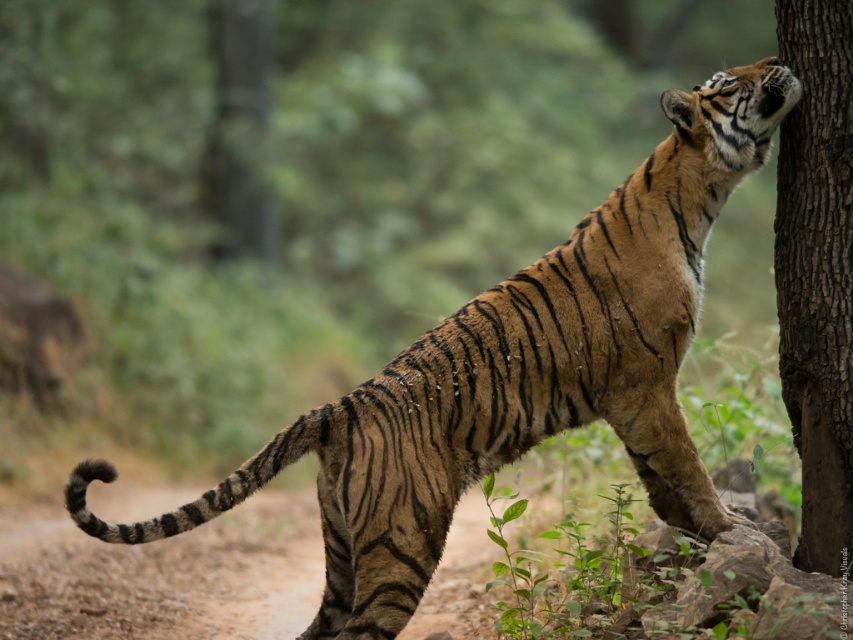
You are a hiker who needs to decide whether to walk on the brown dirt track at lower center or around the brown rough tree trunk at right. Which path requires less space to navigate?

The brown dirt track at lower center is smaller than the brown rough tree trunk at right, so the path around the brown rough tree trunk at right requires more space to navigate, meaning the dirt track is narrower. Therefore, the brown dirt track at lower center requires less space to navigate.

You are a hiker trying to navigate through the forest. You see the brown dirt track at lower center and the brown rough tree trunk at right. Which one is shorter in height?

The brown dirt track at lower center is shorter than the brown rough tree trunk at right.

You are a photographer standing in the forest and want to take a picture of the brown dirt track at lower center and the brown rough tree trunk at right. Which object is closer to you, the photographer?

The brown dirt track at lower center is closer to you because it is further to the viewer than the brown rough tree trunk at right, meaning it appears nearer in the image.